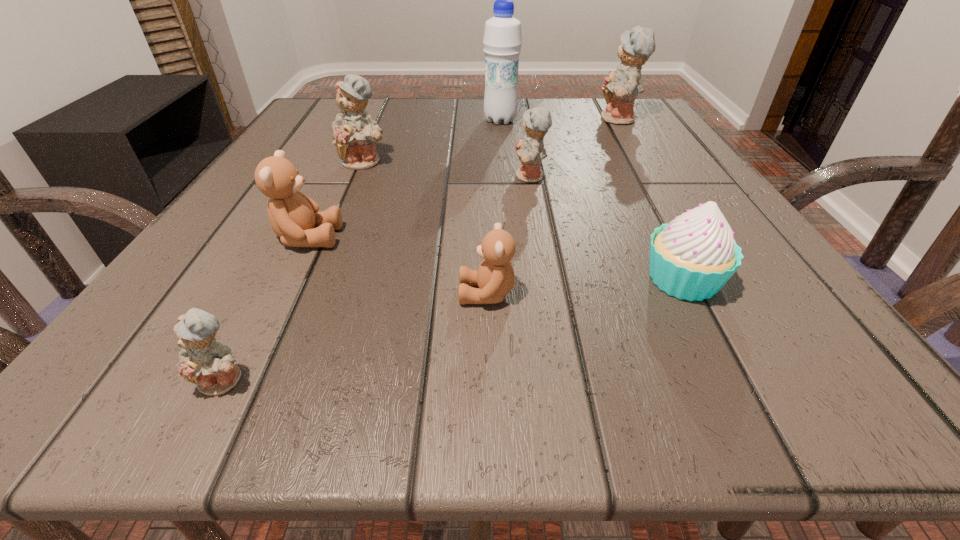
Locate an element on the screen. free location that satisfies the following two spatial constraints: 1. on the face of the white cupcake; 2. on the left side of the third nearest teddy bear is located at coordinates pos(286,280).

The height and width of the screenshot is (540, 960). In order to click on vacant space that satisfies the following two spatial constraints: 1. on the front-facing side of the biggest blue teddy bear; 2. on the front-facing side of the nearest blue teddy bear in this screenshot , I will do `click(778, 381)`.

You are a GUI agent. You are given a task and a screenshot of the screen. Output one action in this format:
    pyautogui.click(x=<x>, y=<y>)
    Task: Click on the vacant space that satisfies the following two spatial constraints: 1. on the front side of the water bottle; 2. on the right side of the cupcake
    This screenshot has height=540, width=960.
    Given the screenshot: What is the action you would take?
    pyautogui.click(x=515, y=280)